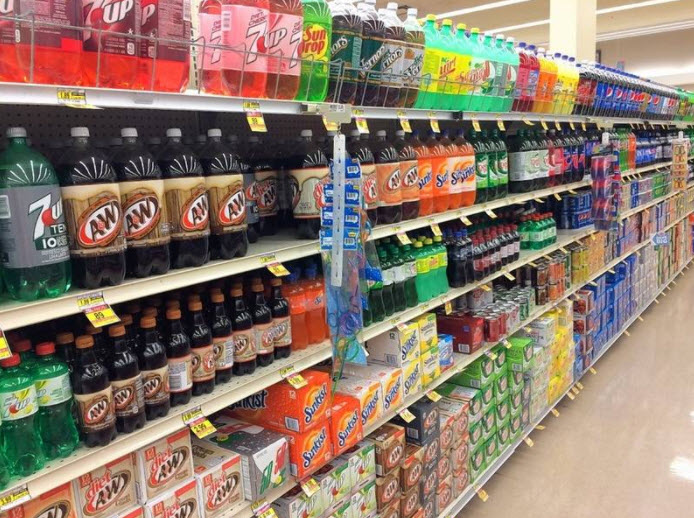
The height and width of the screenshot is (518, 694). Identify the location of shelves. (280, 492), (452, 511), (269, 382), (205, 269), (191, 95).